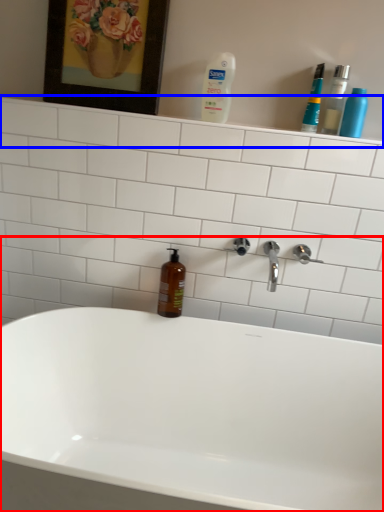
Question: Which object is further to the camera taking this photo, bathtub (highlighted by a red box) or shelve (highlighted by a blue box)?

Choices:
 (A) bathtub
 (B) shelve

Answer: (B)